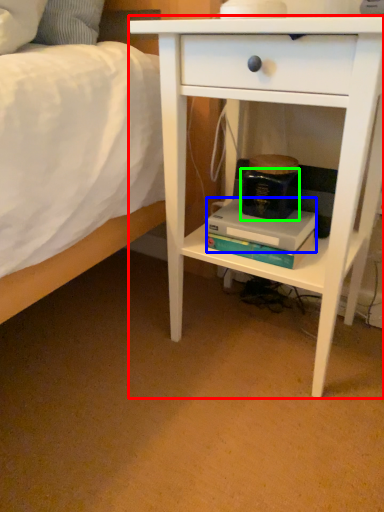
Question: Which is nearer to the nightstand (highlighted by a red box)? paperback book (highlighted by a blue box) or paperback book (highlighted by a green box).

Choices:
 (A) paperback book
 (B) paperback book

Answer: (A)